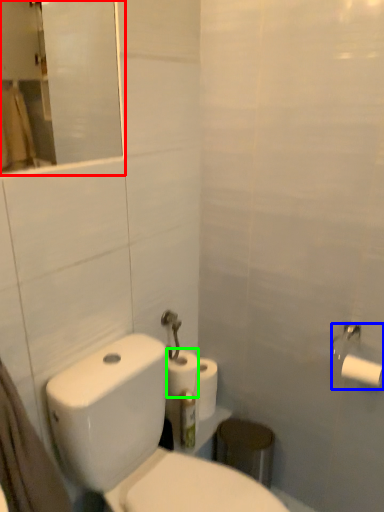
Question: Which is farther away from mirror (highlighted by a red box)? toilet paper (highlighted by a blue box) or toilet paper (highlighted by a green box)?

Choices:
 (A) toilet paper
 (B) toilet paper

Answer: (A)